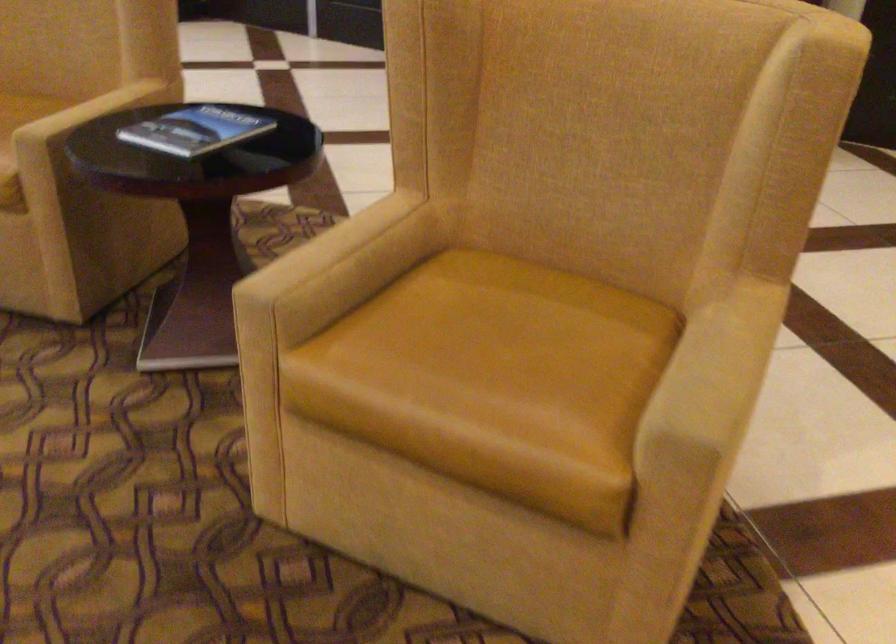
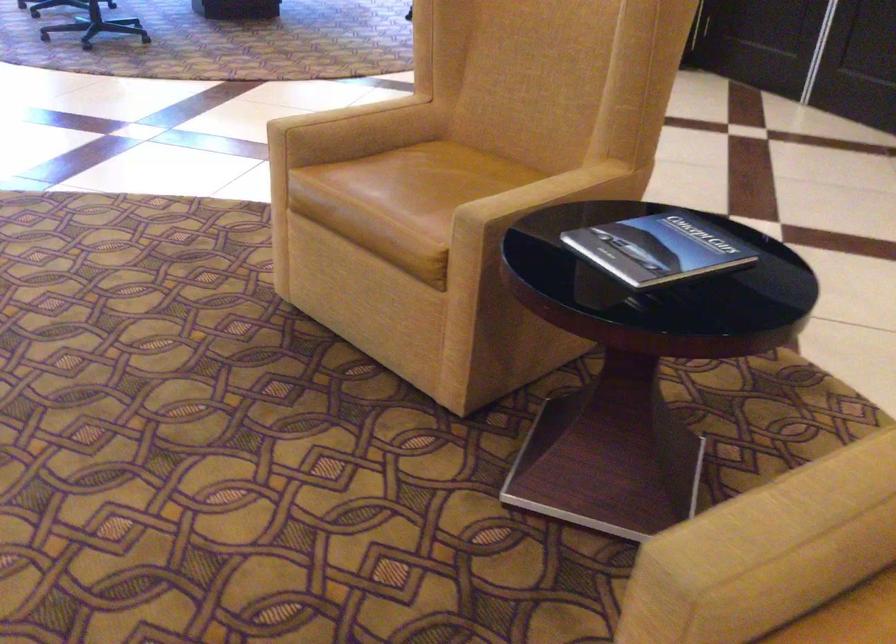
The point at (328, 272) is marked in the first image. Where is the corresponding point in the second image?

(778, 543)